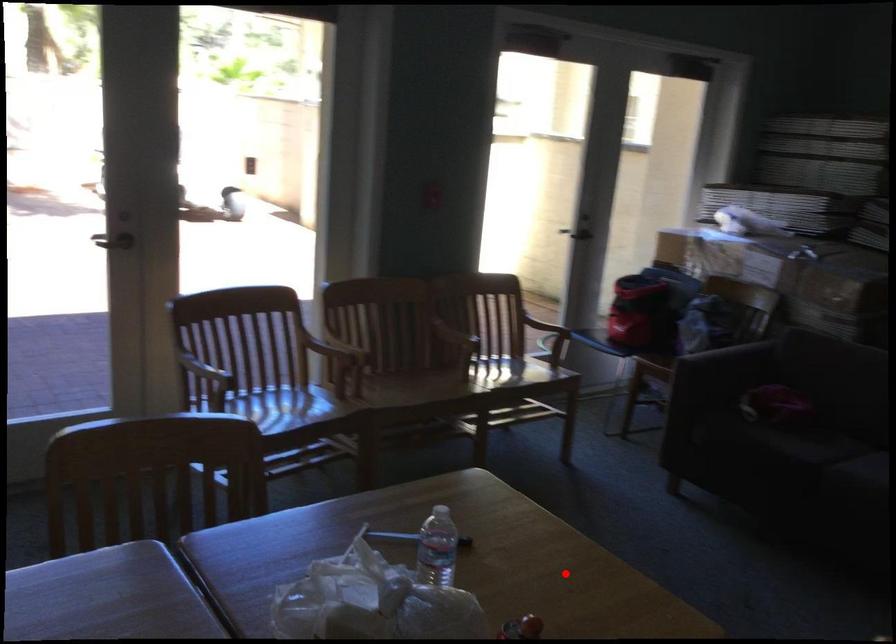
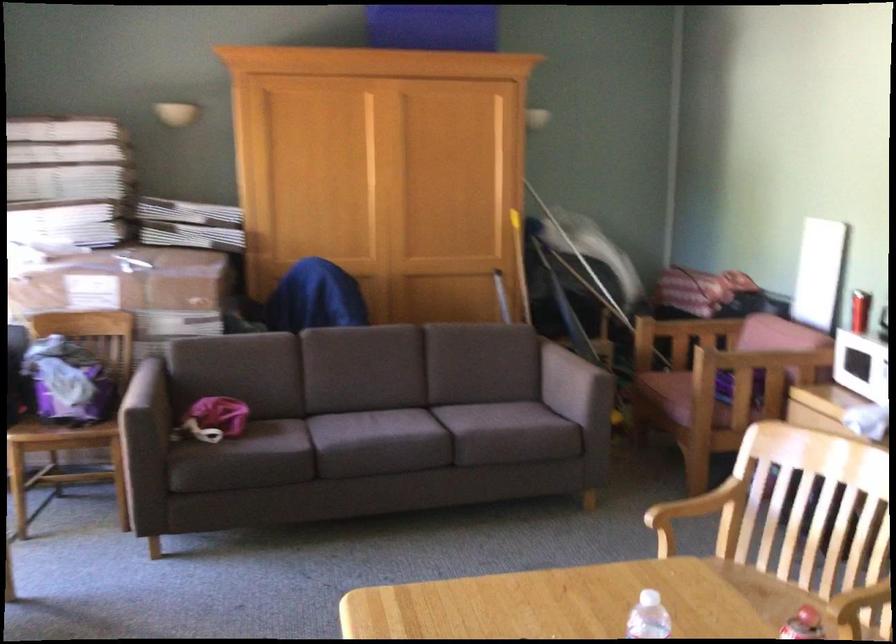
Question: I am providing you with two images of the same scene from different viewpoints. A red point is marked on the first image. At the location where the point appears in image 1, is it still visible in image 2?

Choices:
 (A) Yes
 (B) No

Answer: (A)